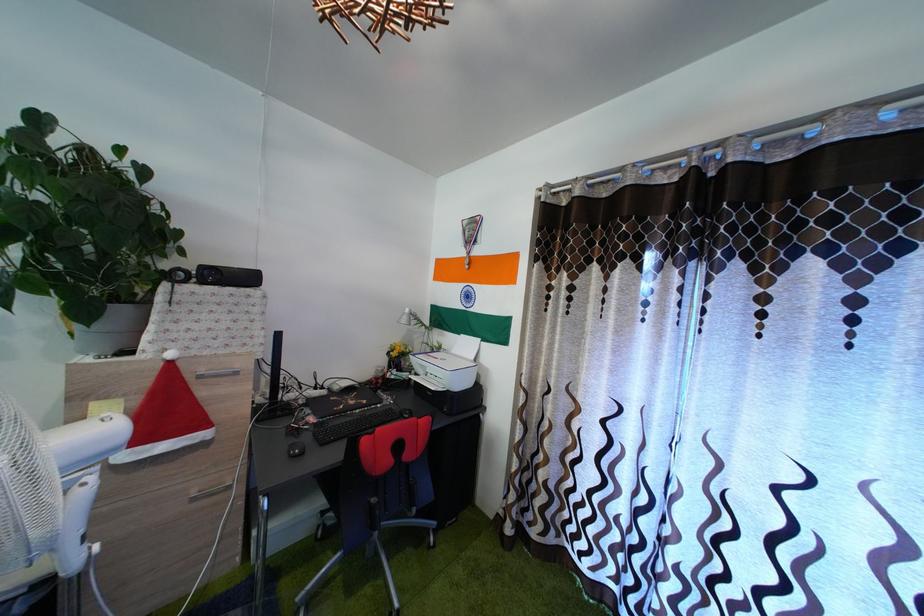
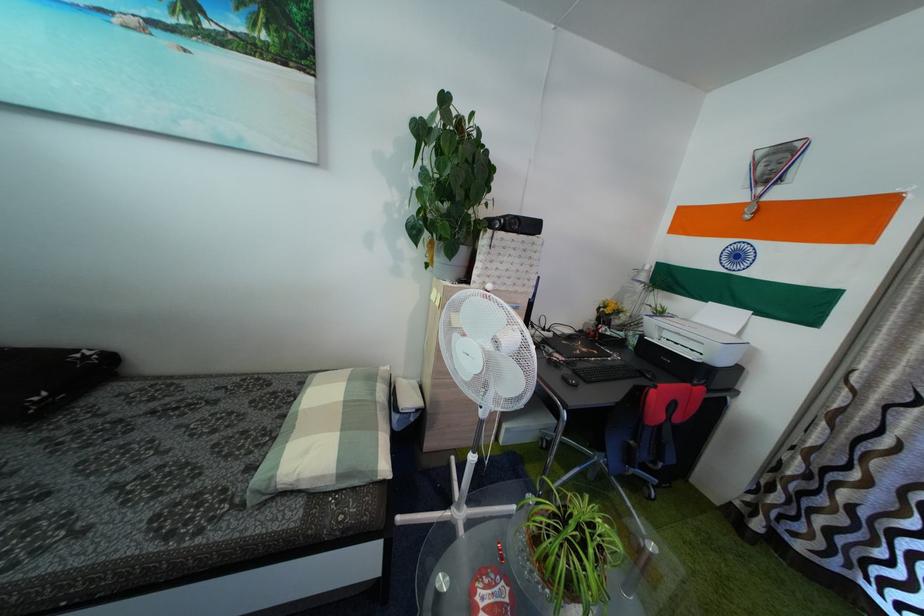
Question: The images are taken continuously from a first-person perspective. In which direction is your viewpoint rotating?

Choices:
 (A) Left
 (B) Right
 (C) Up
 (D) Down

Answer: (A)